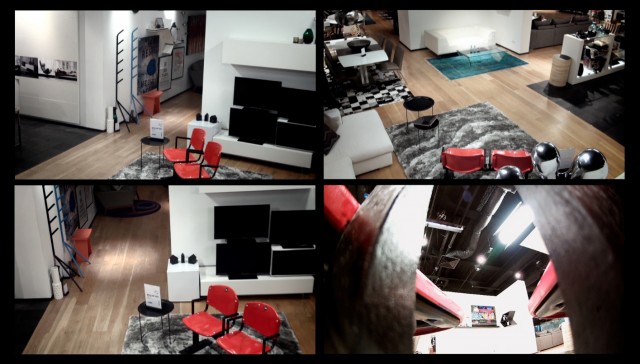
Locate an element on the screen. This screenshot has width=640, height=364. monitor is located at coordinates (299, 105).